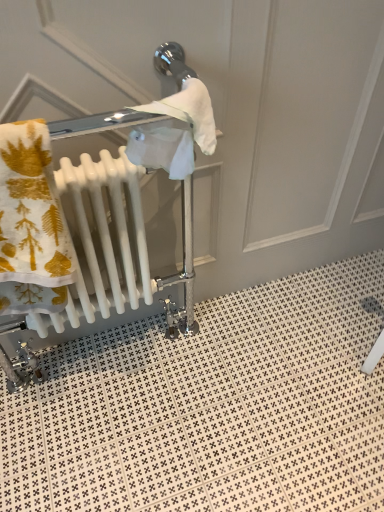
Find the location of a particular element. This screenshot has height=512, width=384. blank area beneath white glossy radiator at left (from a real-world perspective) is located at coordinates (91, 399).